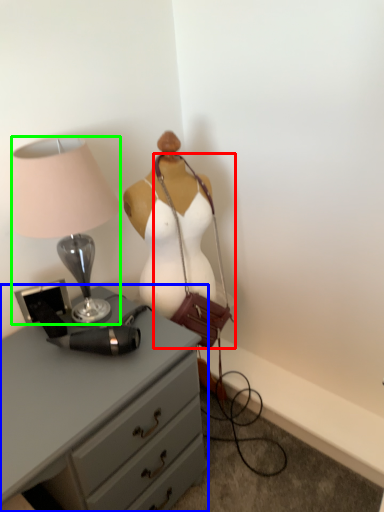
Question: Estimate the real-world distances between objects in this image. Which object is closer to handbag (highlighted by a red box), chest of drawers (highlighted by a blue box) or lamp (highlighted by a green box)?

Choices:
 (A) chest of drawers
 (B) lamp

Answer: (B)